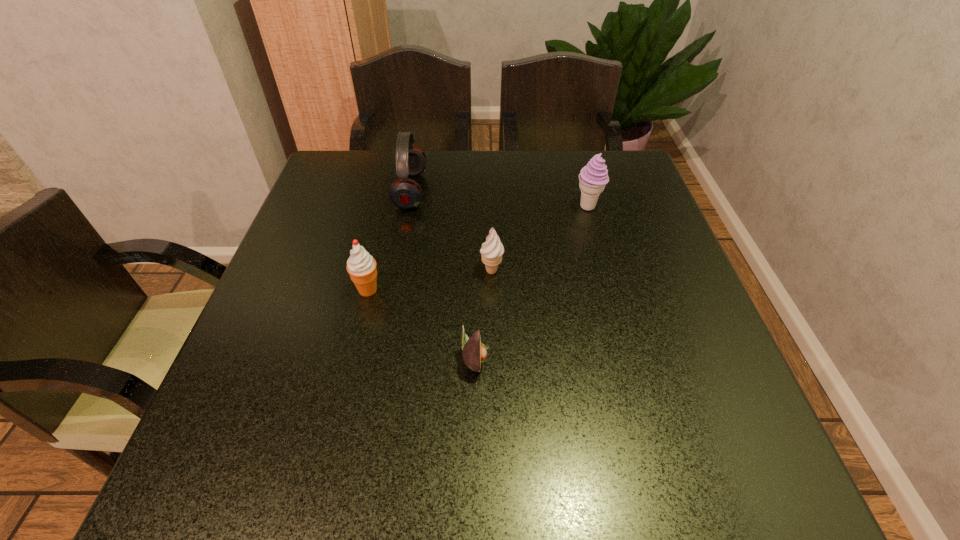
Locate an element on the screen. vacant space at the left edge is located at coordinates (276, 331).

Image resolution: width=960 pixels, height=540 pixels. In the image, there is a desktop. In order to click on free region at the right edge in this screenshot , I will do `click(648, 207)`.

Where is `free space at the far right corner of the desktop`? The image size is (960, 540). free space at the far right corner of the desktop is located at coordinates (637, 177).

Find the location of `free space at the near right corner of the desktop`. free space at the near right corner of the desktop is located at coordinates (767, 463).

Identify the location of unoccupied position between the leftmost icecream and the rightmost object. This screenshot has height=540, width=960. (478, 248).

Locate an element on the screen. free spot between the earphone and the rightmost object is located at coordinates (499, 199).

Where is `empty space that is in between the earphone and the fourth farthest object`? Image resolution: width=960 pixels, height=540 pixels. empty space that is in between the earphone and the fourth farthest object is located at coordinates (390, 240).

Locate an element on the screen. The width and height of the screenshot is (960, 540). vacant space that's between the farthest icecream and the second farthest icecream is located at coordinates (540, 239).

You are a GUI agent. You are given a task and a screenshot of the screen. Output one action in this format:
    pyautogui.click(x=<x>, y=<y>)
    Task: Click on the free space that is in between the nearest icecream and the farthest icecream
    
    Given the screenshot: What is the action you would take?
    pyautogui.click(x=478, y=248)

Where is `free space between the earphone and the avocado`? The height and width of the screenshot is (540, 960). free space between the earphone and the avocado is located at coordinates (444, 274).